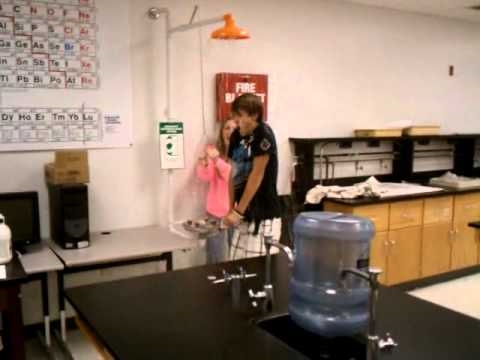
The height and width of the screenshot is (360, 480). I want to click on taps, so click(x=377, y=277), click(x=259, y=294).